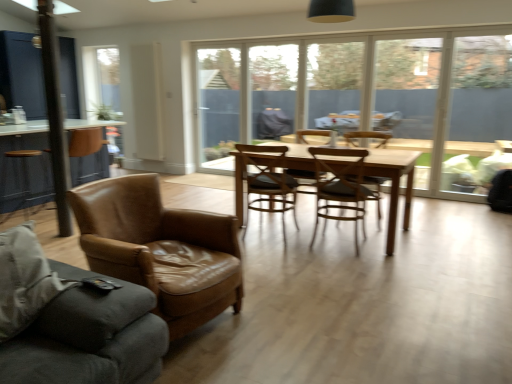
Question: From the image's perspective, relative to wooden chair at center, which is the 5th chair from front to back, is leather couch at left above or below?

Choices:
 (A) above
 (B) below

Answer: (B)

Question: From their relative heights in the image, would you say leather couch at left is taller or shorter than wooden chair at center, placed as the 1th chair when sorted from back to front?

Choices:
 (A) tall
 (B) short

Answer: (B)

Question: Based on their relative distances, which object is farther from the transparent glass window at center, the first window from the left?

Choices:
 (A) light brown wooden table at center
 (B) brown leather table at left
 (C) wooden chair at center, which ranks as the 4th chair in front-to-back order
 (D) leather couch at left
 (E) brown leather armchair at left, the 5th chair viewed from the back

Answer: (D)

Question: Based on their relative distances, which object is nearer to the light brown wooden table at center?

Choices:
 (A) brown leather armchair at left, the 1th chair in the front-to-back sequence
 (B) transparent glass window at center, the first window from the left
 (C) white matte radiator at upper center
 (D) wooden chair at center, the 2th chair from the back
 (E) wooden chair at center, which is the 5th chair from front to back

Answer: (D)